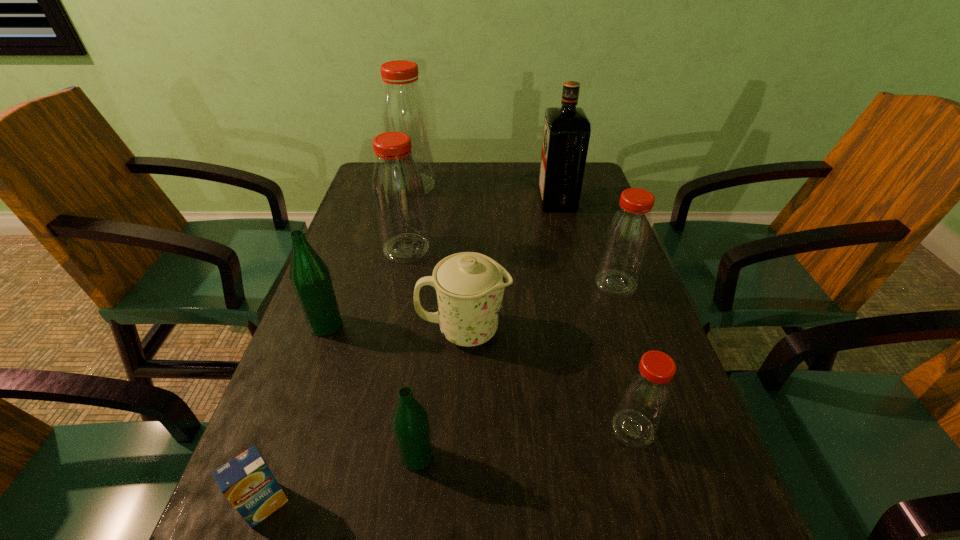
Where is `free space between the third farthest red bottle and the farthest bottle`? The height and width of the screenshot is (540, 960). free space between the third farthest red bottle and the farthest bottle is located at coordinates (514, 234).

Locate an element on the screen. The image size is (960, 540). vacant point located between the smaller green bottle and the third nearest bottle is located at coordinates (372, 391).

Find the location of a particular element. This screenshot has width=960, height=540. the sixth closest object to the blue orange_juice is located at coordinates (627, 238).

Locate an element on the screen. The width and height of the screenshot is (960, 540). object that stands as the closest to the liquor is located at coordinates (627, 238).

What are the coordinates of `bottle that is the third closest to the second tallest bottle` in the screenshot? It's located at (627, 238).

Identify which bottle is the fourth nearest to the farthest red bottle. Please provide its 2D coordinates. Your answer should be formatted as a tuple, i.e. [(x, y)], where the tuple contains the x and y coordinates of a point satisfying the conditions above.

[(410, 422)]

I want to click on the fourth closest red bottle relative to the right green bottle, so click(403, 108).

Point out which red bottle is positioned as the nearest to the second tallest bottle. Please provide its 2D coordinates. Your answer should be formatted as a tuple, i.e. [(x, y)], where the tuple contains the x and y coordinates of a point satisfying the conditions above.

[(403, 108)]

This screenshot has width=960, height=540. What are the coordinates of `vacant region that satisfies the following two spatial constraints: 1. on the back side of the third nearest bottle; 2. on the left side of the third farthest bottle` in the screenshot? It's located at (341, 284).

The width and height of the screenshot is (960, 540). I want to click on vacant space that satisfies the following two spatial constraints: 1. on the front label of the liquor; 2. on the left side of the smallest red bottle, so click(614, 429).